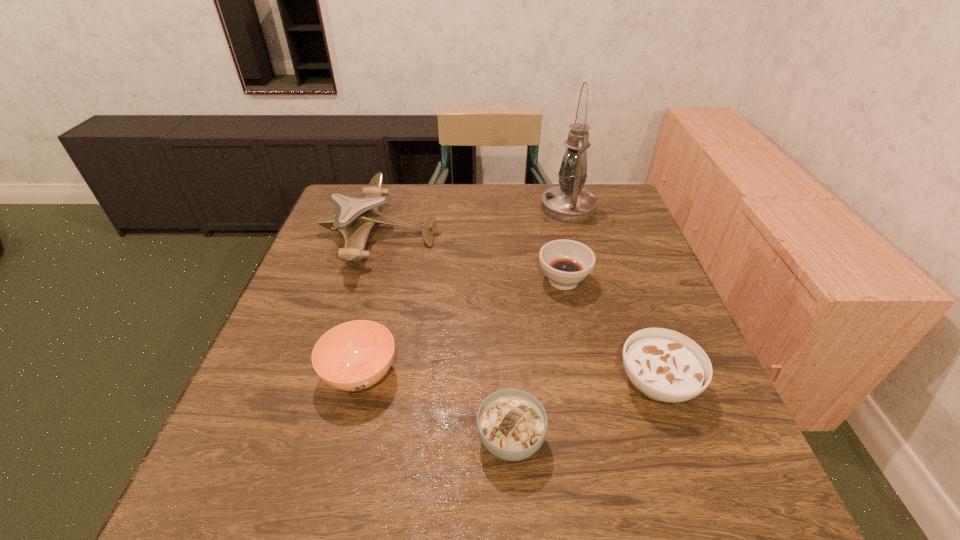
The width and height of the screenshot is (960, 540). Find the location of `oil lamp`. oil lamp is located at coordinates [x=569, y=203].

Identify the location of drone. (355, 216).

Where is `the farthest soup bowl`? the farthest soup bowl is located at coordinates (566, 263).

Where is `the leftmost soup bowl`? This screenshot has height=540, width=960. the leftmost soup bowl is located at coordinates (355, 355).

You are a GUI agent. You are given a task and a screenshot of the screen. Output one action in this format:
    pyautogui.click(x=<x>, y=<y>)
    Task: Click on the fourth object from right to left
    Image resolution: width=960 pixels, height=540 pixels.
    Given the screenshot: What is the action you would take?
    pyautogui.click(x=512, y=424)

Locate an element on the screen. This screenshot has width=960, height=540. vacant space situated 0.180m on the left of the tallest object is located at coordinates [x=480, y=208].

Find the location of a particular element. vacant space located 0.380m on the front-facing side of the drone is located at coordinates (578, 233).

The image size is (960, 540). In order to click on free space located 0.250m on the left of the farthest soup bowl in this screenshot , I will do `click(434, 280)`.

This screenshot has width=960, height=540. Identify the location of free space located on the right of the leftmost soup bowl. (541, 374).

I want to click on free region located on the left of the second soup bowl from left to right, so click(344, 439).